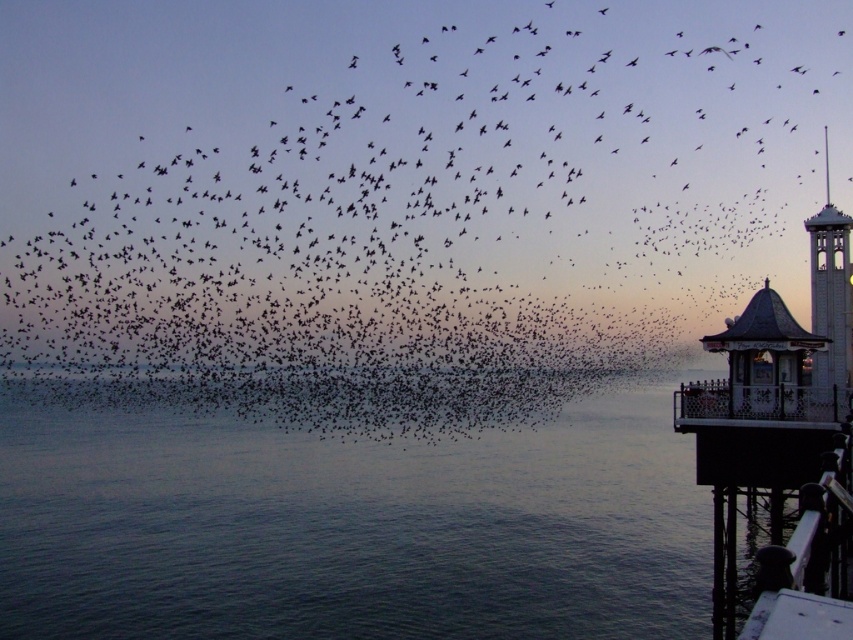
Does white painted wood dock at lower right have a larger size compared to white wood bell tower at right?

Incorrect, white painted wood dock at lower right is not larger than white wood bell tower at right.

Which is below, white painted wood dock at lower right or white wood bell tower at right?

white painted wood dock at lower right

Who is more forward, (850, 630) or (844, 273)?

Point (850, 630)

Image resolution: width=853 pixels, height=640 pixels. Identify the location of white painted wood dock at lower right. (775, 476).

Describe the element at coordinates (775, 476) in the screenshot. I see `white painted wood dock at lower right` at that location.

Is white painted wood dock at lower right taller than black metal/rail at lower right?

Yes, white painted wood dock at lower right is taller than black metal/rail at lower right.

Which is in front, point (769, 416) or point (775, 595)?

Point (775, 595) is in front.

Identify the location of white painted wood dock at lower right. The image size is (853, 640). (775, 476).

Does black matte birds at upper center have a greater height compared to white wood bell tower at right?

Yes.

Is black matte birds at upper center shorter than white wood bell tower at right?

No.

Is point (688, 1) positioned in front of point (814, 260)?

No, (688, 1) is behind (814, 260).

At what (x,y) coordinates should I click in order to perform the action: click on black matte birds at upper center. Please return your answer as a coordinate pair (x, y). The height and width of the screenshot is (640, 853). Looking at the image, I should click on (401, 195).